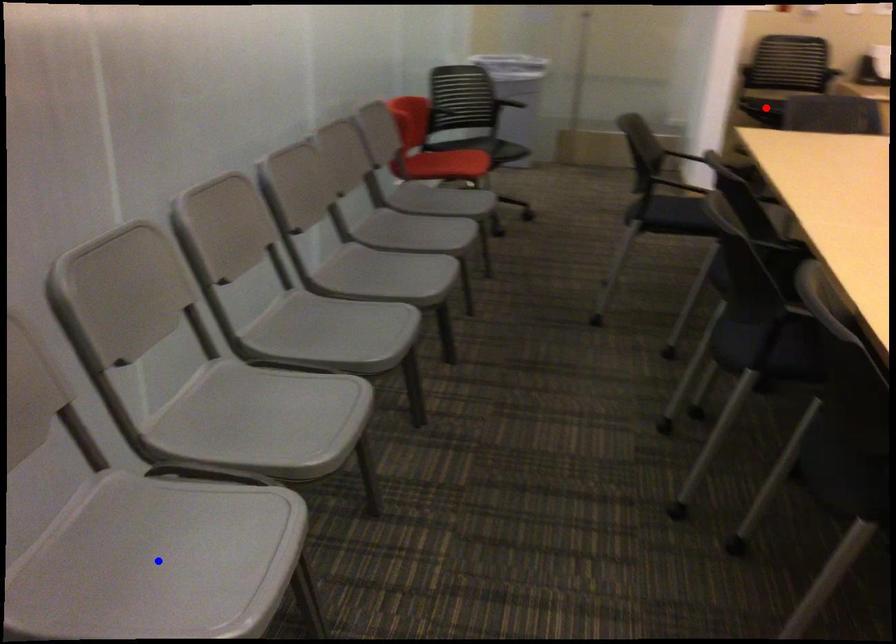
Question: Which of the two points in the image is closer to the camera?

Choices:
 (A) Blue point is closer.
 (B) Red point is closer.

Answer: (A)